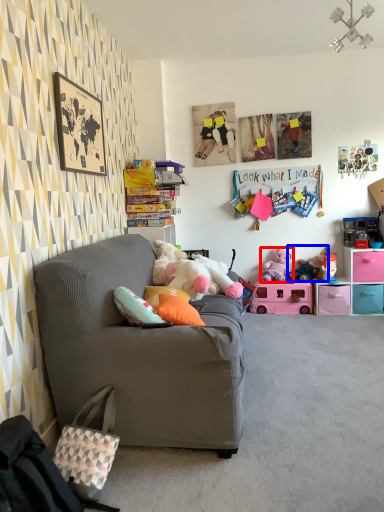
Question: Which point is further to the camera, toy (highlighted by a red box) or toy (highlighted by a blue box)?

Choices:
 (A) toy
 (B) toy

Answer: (A)